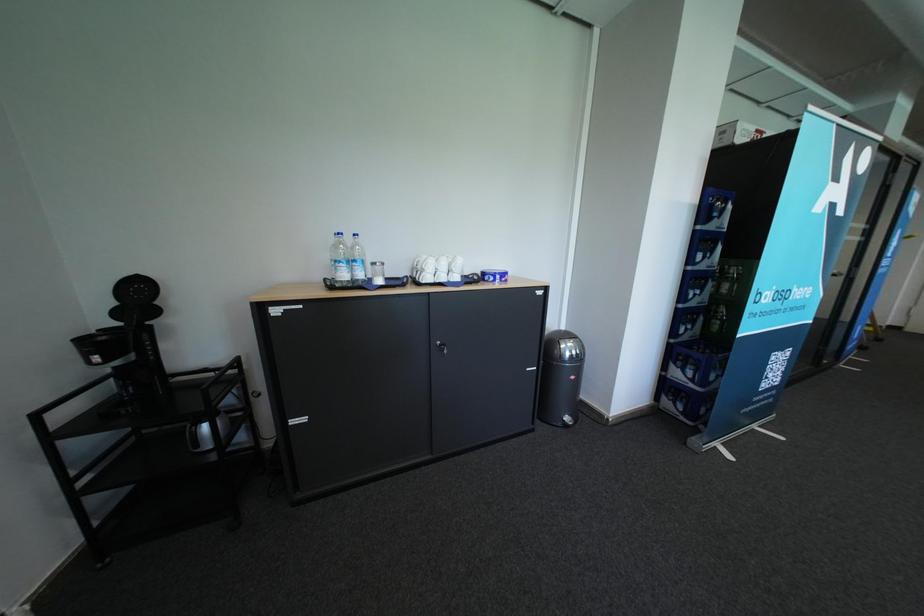
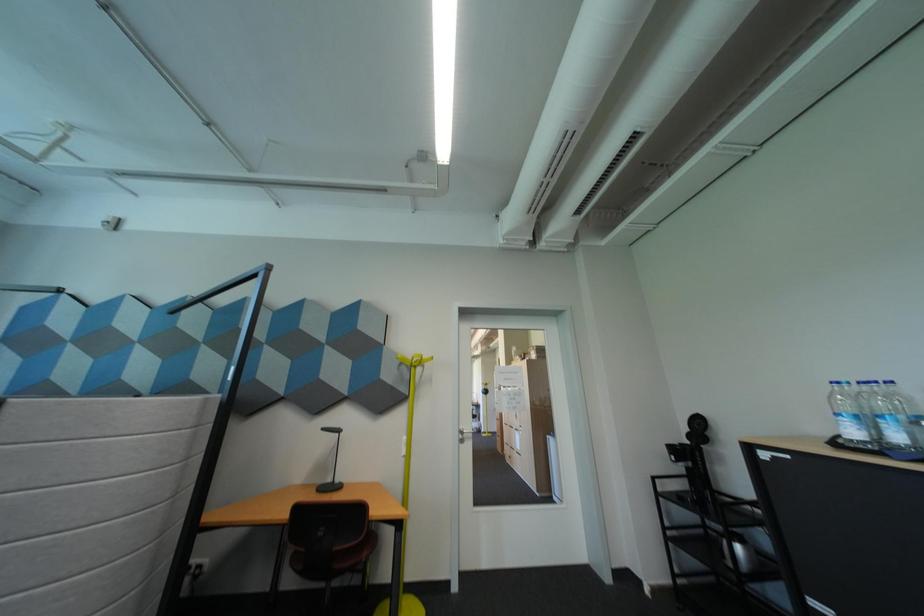
First-person continuous shooting, in which direction is the camera rotating?

The camera's rotation is toward left-up.